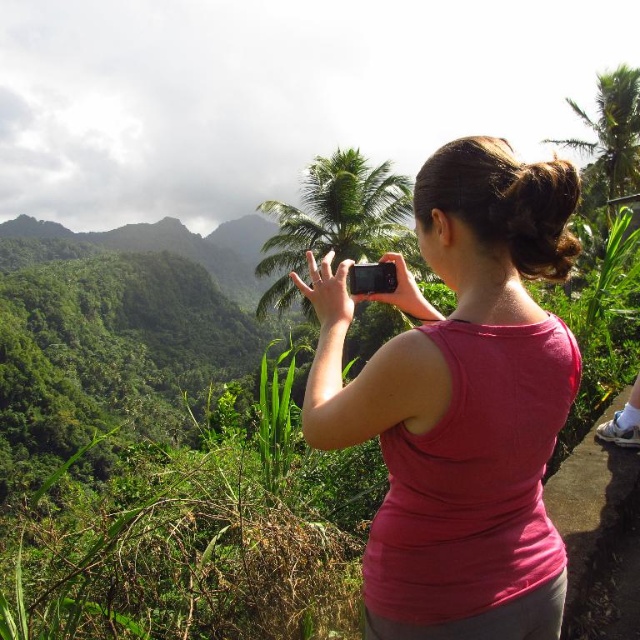
You are a photographer trying to capture the green leafy palm tree at upper right in your shot. Based on the scene, is the pink fabric shirt at center blocking your view of the palm tree?

The pink fabric shirt at center is closer to the viewer than the green leafy palm tree at upper right, so it may be blocking the view of the palm tree depending on the camera angle and zoom level.